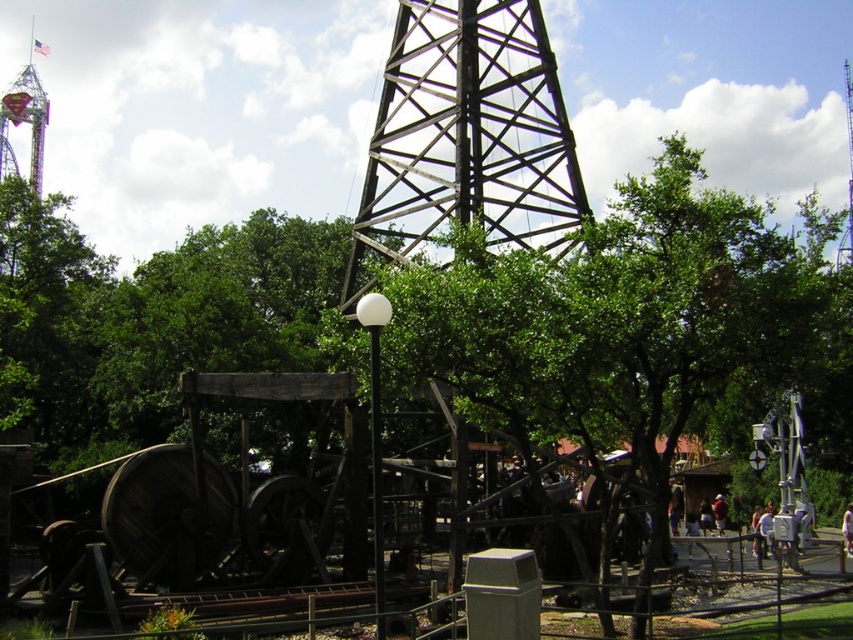
Question: Can you confirm if brushed metal tower at upper left is bigger than white glossy pole at center?

Choices:
 (A) no
 (B) yes

Answer: (B)

Question: Where is brushed metal tower at upper left located in relation to white glossy pole at center in the image?

Choices:
 (A) left
 (B) right

Answer: (A)

Question: Does brushed metal tower at upper left have a larger size compared to white glossy pole at center?

Choices:
 (A) no
 (B) yes

Answer: (B)

Question: Which object is closer to the camera taking this photo?

Choices:
 (A) brushed metal tower at upper left
 (B) white glossy pole at center

Answer: (B)

Question: Which of the following is the closest to the observer?

Choices:
 (A) white glossy pole at center
 (B) brushed metal tower at upper left

Answer: (A)